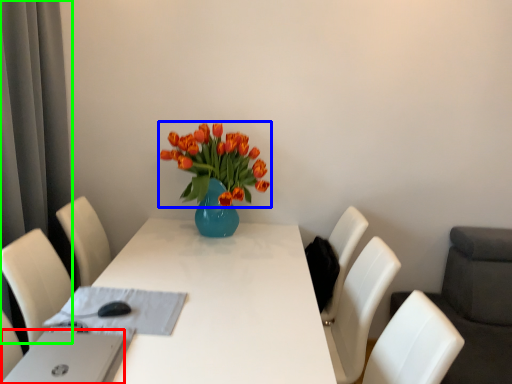
Question: Based on their relative distances, which object is farther from computer (highlighted by a red box)? Choose from flower (highlighted by a blue box) and curtain (highlighted by a green box).

Choices:
 (A) flower
 (B) curtain

Answer: (B)